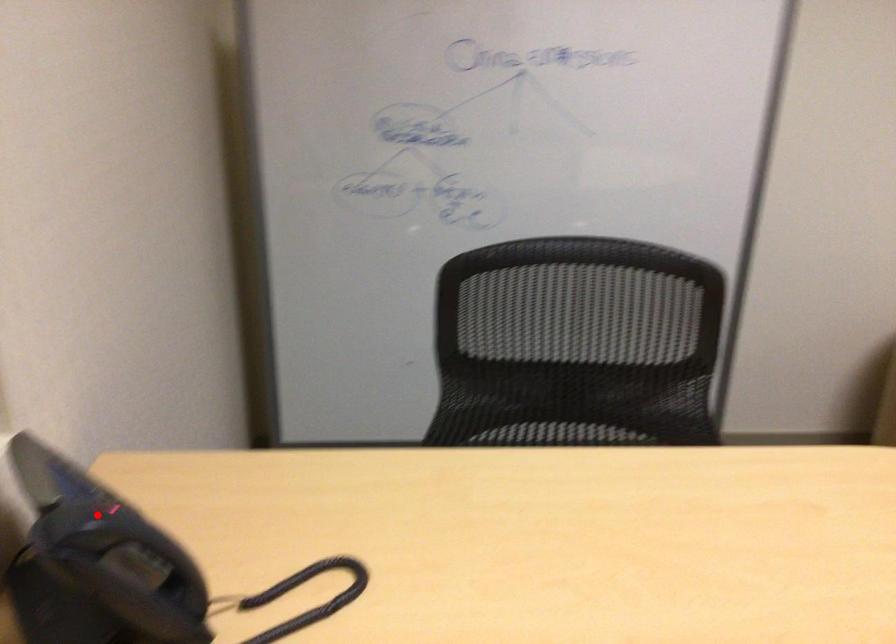
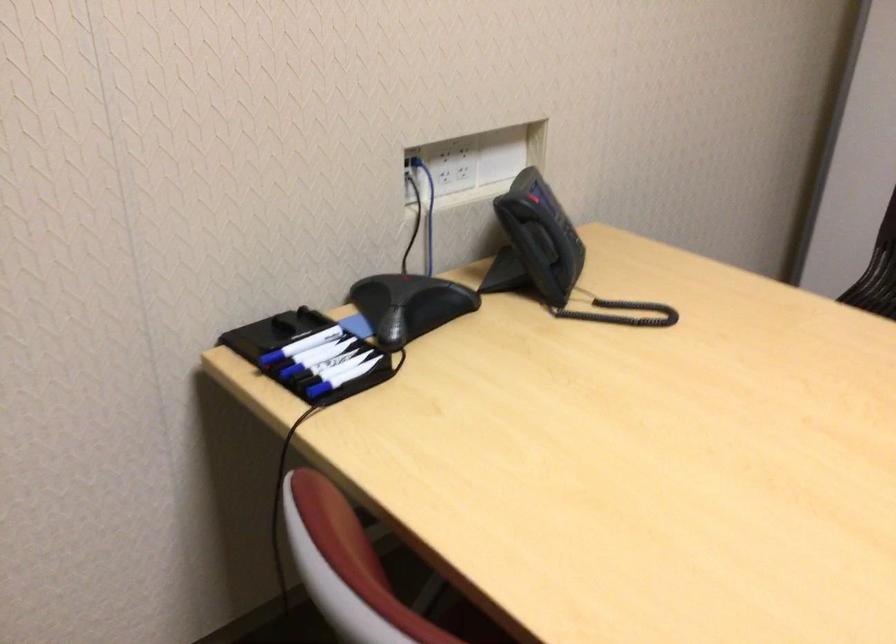
Question: I am providing you with two images of the same scene from different viewpoints. A red point is shown in image1. For the corresponding object point in image2, is it positioned nearer or farther from the camera?

Choices:
 (A) Nearer
 (B) Farther

Answer: (B)